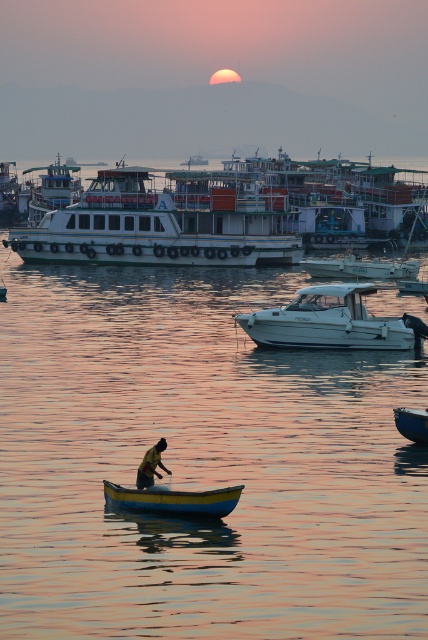
Is yellow polished wood canoe at lower center thinner than yellow fabric shirt at lower center?

No.

Which is in front, point (220, 506) or point (155, 449)?

Point (220, 506) is in front.

Where is `yellow polished wood canoe at lower center`? yellow polished wood canoe at lower center is located at coordinates (172, 499).

Image resolution: width=428 pixels, height=640 pixels. I want to click on yellow polished wood canoe at lower center, so pos(172,499).

Is point (121, 493) positioned before point (425, 420)?

Yes, point (121, 493) is closer to viewer.

In the scene shown: Does yellow polished wood canoe at lower center appear on the left side of smooth blue boat at lower right?

Indeed, yellow polished wood canoe at lower center is positioned on the left side of smooth blue boat at lower right.

Where is `yellow polished wood canoe at lower center`? This screenshot has height=640, width=428. yellow polished wood canoe at lower center is located at coordinates point(172,499).

You are a GUI agent. You are given a task and a screenshot of the screen. Output one action in this format:
    pyautogui.click(x=<x>, y=<y>)
    Task: Click on the yellow polished wood canoe at lower center
    The image size is (428, 640).
    Given the screenshot: What is the action you would take?
    coord(172,499)

Is white glossy boat at center closer to the viewer compared to smooth blue boat at lower right?

No, it is behind smooth blue boat at lower right.

Does white glossy boat at center have a larger size compared to smooth blue boat at lower right?

Correct, white glossy boat at center is larger in size than smooth blue boat at lower right.

Between point (323, 344) and point (410, 419), which one is positioned behind?

Point (323, 344)

Find the location of a particular element. white glossy boat at center is located at coordinates (327, 321).